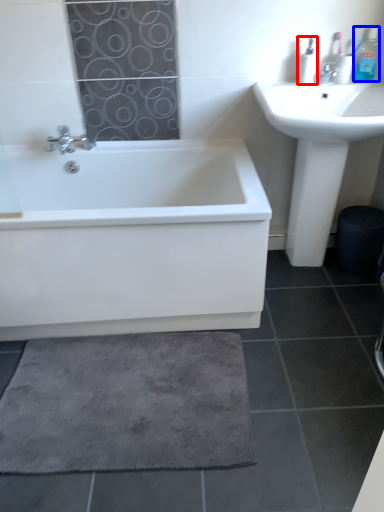
Question: Which of the following is the farthest to the observer, toiletry (highlighted by a red box) or toiletry (highlighted by a blue box)?

Choices:
 (A) toiletry
 (B) toiletry

Answer: (A)